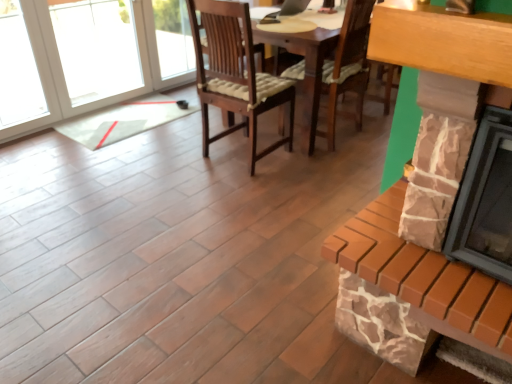
Question: Does point (462, 246) appear closer or farther from the camera than point (416, 44)?

Choices:
 (A) farther
 (B) closer

Answer: (A)

Question: From a real-world perspective, relative to brick fireplace at right, which is counted as the 1th fireplace, starting from the bottom, is stone fireplace at right, the second fireplace when ordered from bottom to top, vertically above or below?

Choices:
 (A) above
 (B) below

Answer: (A)

Question: In terms of size, does stone fireplace at right, the 1th fireplace from the top, appear bigger or smaller than brick fireplace at right, which is counted as the 1th fireplace, starting from the bottom?

Choices:
 (A) big
 (B) small

Answer: (A)

Question: From a real-world perspective, is brick fireplace at right, the second fireplace viewed from the top, positioned above or below stone fireplace at right, the second fireplace when ordered from bottom to top?

Choices:
 (A) below
 (B) above

Answer: (A)

Question: Is point (444, 274) positioned closer to the camera than point (465, 167)?

Choices:
 (A) farther
 (B) closer

Answer: (A)

Question: Considering the relative positions of brick fireplace at right, the second fireplace viewed from the top, and stone fireplace at right, the 1th fireplace from the top, in the image provided, is brick fireplace at right, the second fireplace viewed from the top, to the left or to the right of stone fireplace at right, the 1th fireplace from the top,?

Choices:
 (A) left
 (B) right

Answer: (A)

Question: Considering their positions, is brick fireplace at right, which is counted as the 1th fireplace, starting from the bottom, located in front of or behind stone fireplace at right, the 1th fireplace from the top?

Choices:
 (A) behind
 (B) front

Answer: (A)